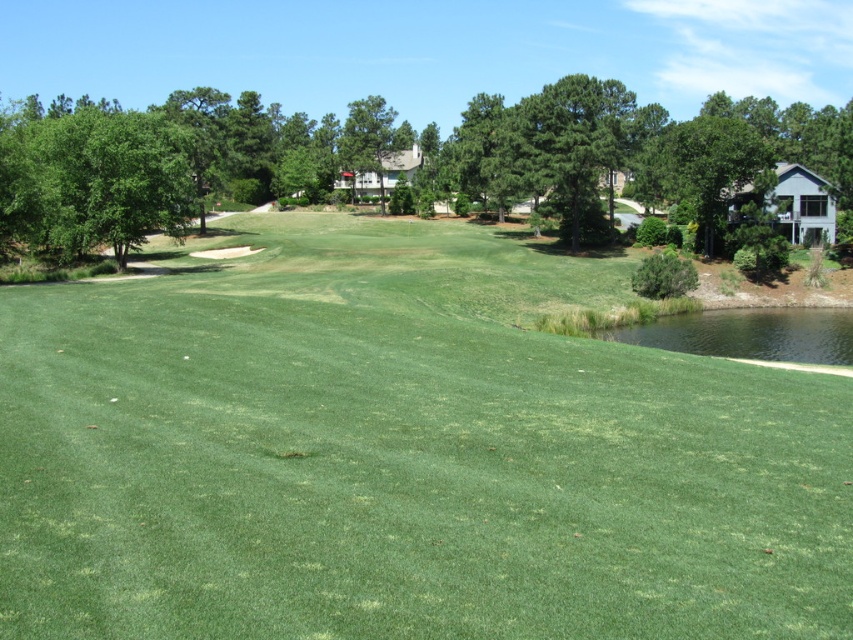
Is green grass at center below green leafy tree at upper left?

Indeed, green grass at center is positioned under green leafy tree at upper left.

Who is positioned more to the left, green grass at center or green leafy tree at upper left?

green leafy tree at upper left is more to the left.

Is point (276, 397) more distant than point (25, 170)?

No, (276, 397) is in front of (25, 170).

Identify the location of green grass at center. This screenshot has height=640, width=853. (401, 454).

Between green leafy tree at upper center and green leafy tree at center, which one is positioned lower?

green leafy tree at upper center is lower down.

Does green leafy tree at upper center have a greater width compared to green leafy tree at center?

Correct, the width of green leafy tree at upper center exceeds that of green leafy tree at center.

Is point (19, 177) positioned before point (369, 97)?

Yes, point (19, 177) is in front of point (369, 97).

Where is `green leafy tree at upper center`? green leafy tree at upper center is located at coordinates (167, 163).

In the scene shown: Is the position of green grass at center more distant than that of green leafy tree at upper center?

That is False.

From the picture: Is green grass at center shorter than green leafy tree at upper center?

Indeed, green grass at center has a lesser height compared to green leafy tree at upper center.

Which is in front, point (753, 486) or point (636, 145)?

Positioned in front is point (753, 486).

In order to click on green grass at center in this screenshot , I will do `click(401, 454)`.